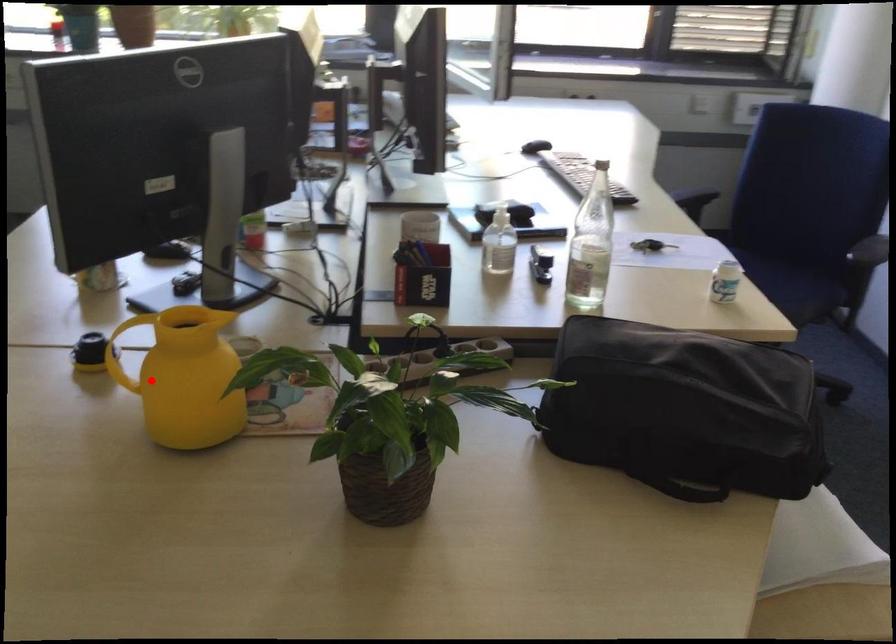
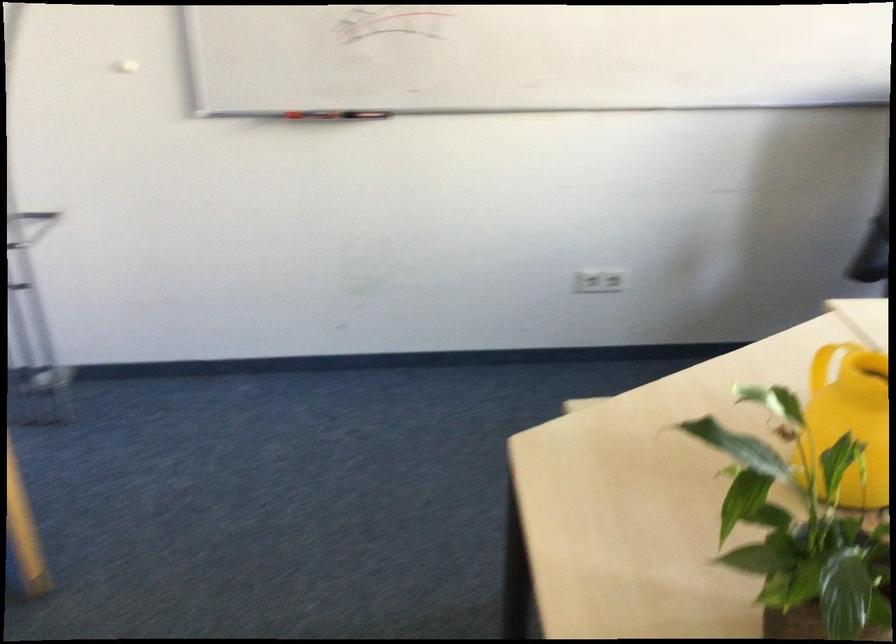
In the second image, find the point that corresponds to the highlighted location in the first image.

(849, 420)